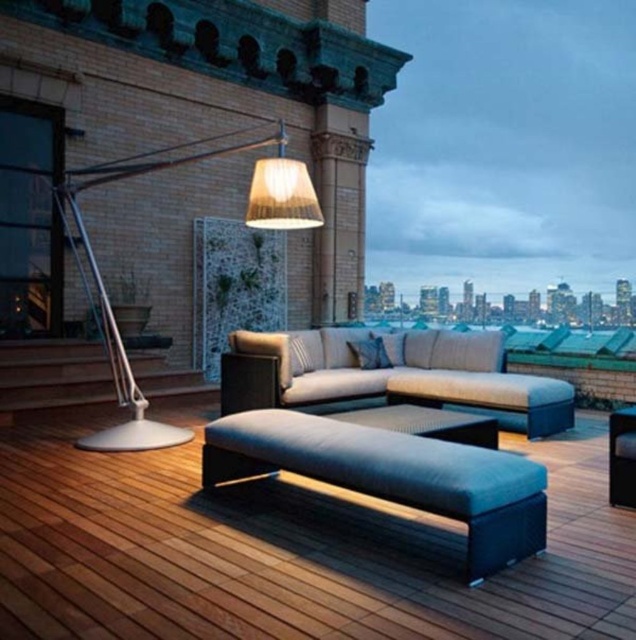
Between point (427, 474) and point (155, 422), which one is positioned behind?

The point (155, 422) is behind.

Who is positioned more to the right, velvet dark blue bench at center or metallic silver floor lamp at upper left?

Positioned to the right is velvet dark blue bench at center.

Is point (424, 461) positioned before point (169, 147)?

Yes, it is.

You are a GUI agent. You are given a task and a screenshot of the screen. Output one action in this format:
    pyautogui.click(x=<x>, y=<y>)
    Task: Click on the velvet dark blue bench at center
    This screenshot has height=640, width=636.
    Given the screenshot: What is the action you would take?
    pyautogui.click(x=392, y=476)

Who is higher up, textured beige couch at center or metallic silver floor lamp at upper left?

metallic silver floor lamp at upper left is higher up.

Is textured beige couch at center further to the viewer compared to metallic silver floor lamp at upper left?

No, textured beige couch at center is closer to the viewer.

Between point (318, 390) and point (114, 173), which one is positioned in front?

Point (114, 173) is more forward.

Where is `textured beige couch at center`? This screenshot has width=636, height=640. textured beige couch at center is located at coordinates (391, 376).

Between velvet dark blue bench at center and textured beige couch at center, which one has more height?

Standing taller between the two is textured beige couch at center.

Does velvet dark blue bench at center appear on the left side of textured beige couch at center?

Yes, velvet dark blue bench at center is to the left of textured beige couch at center.

Between point (321, 451) and point (560, 420), which one is positioned in front?

Point (321, 451) is in front.

Identify the location of velvet dark blue bench at center. (392, 476).